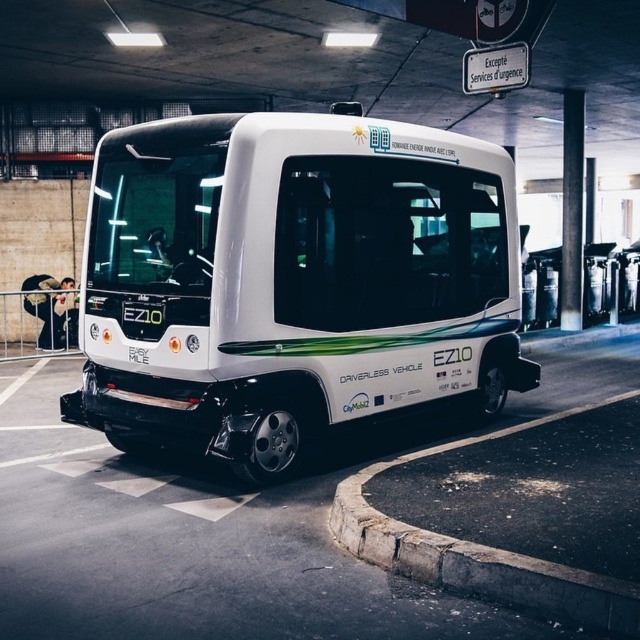
Who is shorter, white glossy driverless vehicle at center or concrete at lower right?

concrete at lower right

Can you confirm if white glossy driverless vehicle at center is positioned to the right of concrete at lower right?

Correct, you'll find white glossy driverless vehicle at center to the right of concrete at lower right.

You are a GUI agent. You are given a task and a screenshot of the screen. Output one action in this format:
    pyautogui.click(x=<x>, y=<y>)
    Task: Click on the white glossy driverless vehicle at center
    Image resolution: width=640 pixels, height=640 pixels.
    Given the screenshot: What is the action you would take?
    pyautogui.click(x=232, y=525)

This screenshot has height=640, width=640. What are the coordinates of `white glossy driverless vehicle at center` in the screenshot? It's located at (232, 525).

This screenshot has width=640, height=640. Identify the location of white matte driverless vehicle at center. (291, 282).

Is white matte driverless vehicle at center taller than white glossy driverless vehicle at center?

Yes, white matte driverless vehicle at center is taller than white glossy driverless vehicle at center.

At what (x,y) coordinates should I click in order to perform the action: click on white matte driverless vehicle at center. Please return your answer as a coordinate pair (x, y). The image size is (640, 640). Looking at the image, I should click on (291, 282).

Does white matte driverless vehicle at center have a larger size compared to concrete at lower right?

Yes.

Between white matte driverless vehicle at center and concrete at lower right, which one is positioned lower?

concrete at lower right is lower down.

The height and width of the screenshot is (640, 640). What are the coordinates of `white matte driverless vehicle at center` in the screenshot? It's located at (291, 282).